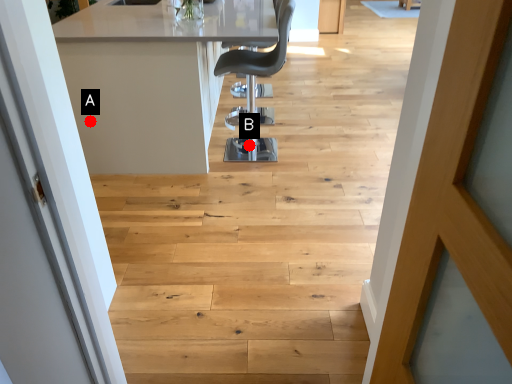
Question: Two points are circled on the image, labeled by A and B beside each circle. Which point is closer to the camera?

Choices:
 (A) A is closer
 (B) B is closer

Answer: (A)